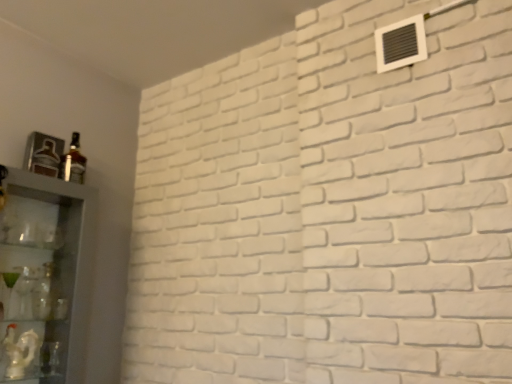
The width and height of the screenshot is (512, 384). What are the coordinates of `white glossy statue at lower left, which ranks as the 2th shelf in top-to-bottom order` in the screenshot? It's located at (31, 353).

I want to click on clear glass cabinet at left, marked as the 2th shelf in a bottom-to-top arrangement, so click(44, 277).

The image size is (512, 384). I want to click on white glossy statue at lower left, marked as the first shelf in a bottom-to-top arrangement, so click(31, 353).

Considering the relative positions of white glossy statue at lower left, which ranks as the 2th shelf in top-to-bottom order, and white plastic air conditioning unit at upper right in the image provided, is white glossy statue at lower left, which ranks as the 2th shelf in top-to-bottom order, to the left of white plastic air conditioning unit at upper right from the viewer's perspective?

Yes, white glossy statue at lower left, which ranks as the 2th shelf in top-to-bottom order, is to the left of white plastic air conditioning unit at upper right.

Could you measure the distance between white glossy statue at lower left, which ranks as the 2th shelf in top-to-bottom order, and white plastic air conditioning unit at upper right?

A distance of 5.27 feet exists between white glossy statue at lower left, which ranks as the 2th shelf in top-to-bottom order, and white plastic air conditioning unit at upper right.

Is there a large distance between white glossy statue at lower left, which ranks as the 2th shelf in top-to-bottom order, and white plastic air conditioning unit at upper right?

Indeed, white glossy statue at lower left, which ranks as the 2th shelf in top-to-bottom order, is not near white plastic air conditioning unit at upper right.

Is white glossy statue at lower left, marked as the first shelf in a bottom-to-top arrangement, positioned beyond the bounds of white plastic air conditioning unit at upper right?

Yes, white glossy statue at lower left, marked as the first shelf in a bottom-to-top arrangement, is outside of white plastic air conditioning unit at upper right.

From the image's perspective, which one is positioned higher, clear glass cabinet at left, marked as the 2th shelf in a bottom-to-top arrangement, or matte glass bottle at left?

matte glass bottle at left is shown above in the image.

Which of these two, clear glass cabinet at left, positioned as the 1th shelf in top-to-bottom order, or matte glass bottle at left, stands shorter?

matte glass bottle at left.

From the picture: Is clear glass cabinet at left, positioned as the 1th shelf in top-to-bottom order, placed right next to matte glass bottle at left?

No.

From the image's perspective, count 1st shelfs downward from the matte glass bottle at left and point to it. Please provide its 2D coordinates.

[(44, 277)]

Based on the photo, are white plastic air conditioning unit at upper right and white glossy statue at lower left, which ranks as the 2th shelf in top-to-bottom order, beside each other?

No, white plastic air conditioning unit at upper right is not with white glossy statue at lower left, which ranks as the 2th shelf in top-to-bottom order.

Who is taller, white plastic air conditioning unit at upper right or white glossy statue at lower left, marked as the first shelf in a bottom-to-top arrangement?

white glossy statue at lower left, marked as the first shelf in a bottom-to-top arrangement, is taller.

Is white plastic air conditioning unit at upper right facing towards white glossy statue at lower left, marked as the first shelf in a bottom-to-top arrangement?

No, white plastic air conditioning unit at upper right is not aimed at white glossy statue at lower left, marked as the first shelf in a bottom-to-top arrangement.

From the image's perspective, is white plastic air conditioning unit at upper right above white glossy statue at lower left, which ranks as the 2th shelf in top-to-bottom order?

Yes, from the image's perspective, white plastic air conditioning unit at upper right is on top of white glossy statue at lower left, which ranks as the 2th shelf in top-to-bottom order.

Locate an element on the screen. shelf in front of the white plastic air conditioning unit at upper right is located at coordinates (44, 277).

From a real-world perspective, which is physically below, white plastic air conditioning unit at upper right or clear glass cabinet at left, positioned as the 1th shelf in top-to-bottom order?

From a 3D spatial view, clear glass cabinet at left, positioned as the 1th shelf in top-to-bottom order, is below.

Does point (378, 64) come farther from viewer compared to point (40, 191)?

No.

Which of these two, white glossy statue at lower left, marked as the first shelf in a bottom-to-top arrangement, or matte glass bottle at left, is bigger?

white glossy statue at lower left, marked as the first shelf in a bottom-to-top arrangement.

Is white glossy statue at lower left, which ranks as the 2th shelf in top-to-bottom order, positioned with its back to matte glass bottle at left?

No, white glossy statue at lower left, which ranks as the 2th shelf in top-to-bottom order, is not facing away from matte glass bottle at left.

Considering the sizes of objects white glossy statue at lower left, marked as the first shelf in a bottom-to-top arrangement, and matte glass bottle at left in the image provided, who is taller, white glossy statue at lower left, marked as the first shelf in a bottom-to-top arrangement, or matte glass bottle at left?

matte glass bottle at left.

Which object is further away from the camera taking this photo, white glossy statue at lower left, which ranks as the 2th shelf in top-to-bottom order, or matte glass bottle at left?

matte glass bottle at left is further away from the camera.

Between matte glass bottle at left and white glossy statue at lower left, which ranks as the 2th shelf in top-to-bottom order, which one appears on the left side from the viewer's perspective?

white glossy statue at lower left, which ranks as the 2th shelf in top-to-bottom order.

Is matte glass bottle at left placed right next to white glossy statue at lower left, marked as the first shelf in a bottom-to-top arrangement?

No.

Considering the sizes of matte glass bottle at left and white glossy statue at lower left, marked as the first shelf in a bottom-to-top arrangement, in the image, is matte glass bottle at left taller or shorter than white glossy statue at lower left, marked as the first shelf in a bottom-to-top arrangement,?

In the image, matte glass bottle at left appears to be taller than white glossy statue at lower left, marked as the first shelf in a bottom-to-top arrangement.

Which is nearer, (83, 170) or (50, 365)?

The point (50, 365) is closer to the camera.

From a real-world perspective, is white glossy statue at lower left, which ranks as the 2th shelf in top-to-bottom order, physically above clear glass cabinet at left, marked as the 2th shelf in a bottom-to-top arrangement?

No.

Considering the sizes of objects white glossy statue at lower left, marked as the first shelf in a bottom-to-top arrangement, and clear glass cabinet at left, positioned as the 1th shelf in top-to-bottom order, in the image provided, who is wider, white glossy statue at lower left, marked as the first shelf in a bottom-to-top arrangement, or clear glass cabinet at left, positioned as the 1th shelf in top-to-bottom order,?

Wider between the two is clear glass cabinet at left, positioned as the 1th shelf in top-to-bottom order.

Consider the image. Is white glossy statue at lower left, which ranks as the 2th shelf in top-to-bottom order, in contact with clear glass cabinet at left, marked as the 2th shelf in a bottom-to-top arrangement?

white glossy statue at lower left, which ranks as the 2th shelf in top-to-bottom order, is not next to clear glass cabinet at left, marked as the 2th shelf in a bottom-to-top arrangement, and they're not touching.

Considering the points (52, 355) and (3, 255), which point is in front, point (52, 355) or point (3, 255)?

The point (52, 355) is more forward.

From a real-world perspective, starting from the white plastic air conditioning unit at upper right, which shelf is the 2nd one below it? Please provide its 2D coordinates.

[(31, 353)]

Find the location of a particular element. bottle that appears on the right of clear glass cabinet at left, marked as the 2th shelf in a bottom-to-top arrangement is located at coordinates (74, 162).

Looking at the image, which one is located further to white plastic air conditioning unit at upper right, clear glass cabinet at left, positioned as the 1th shelf in top-to-bottom order, or matte glass bottle at left?

The object further to white plastic air conditioning unit at upper right is clear glass cabinet at left, positioned as the 1th shelf in top-to-bottom order.

Looking at the image, which one is located closer to white plastic air conditioning unit at upper right, matte glass bottle at left or white glossy statue at lower left, which ranks as the 2th shelf in top-to-bottom order?

matte glass bottle at left is closer to white plastic air conditioning unit at upper right.

When comparing their distances from white glossy statue at lower left, which ranks as the 2th shelf in top-to-bottom order, does white plastic air conditioning unit at upper right or clear glass cabinet at left, marked as the 2th shelf in a bottom-to-top arrangement, seem further?

white plastic air conditioning unit at upper right lies further to white glossy statue at lower left, which ranks as the 2th shelf in top-to-bottom order, than the other object.

Based on their spatial positions, is clear glass cabinet at left, positioned as the 1th shelf in top-to-bottom order, or white plastic air conditioning unit at upper right closer to matte glass bottle at left?

clear glass cabinet at left, positioned as the 1th shelf in top-to-bottom order, is positioned closer to the anchor matte glass bottle at left.

Looking at the image, which one is located closer to matte glass bottle at left, white plastic air conditioning unit at upper right or white glossy statue at lower left, marked as the first shelf in a bottom-to-top arrangement?

white glossy statue at lower left, marked as the first shelf in a bottom-to-top arrangement, lies closer to matte glass bottle at left than the other object.

Which object lies nearer to the anchor point white glossy statue at lower left, which ranks as the 2th shelf in top-to-bottom order, matte glass bottle at left or white plastic air conditioning unit at upper right?

Among the two, matte glass bottle at left is located nearer to white glossy statue at lower left, which ranks as the 2th shelf in top-to-bottom order.

From the image, which object appears to be nearer to white glossy statue at lower left, marked as the first shelf in a bottom-to-top arrangement, clear glass cabinet at left, positioned as the 1th shelf in top-to-bottom order, or white plastic air conditioning unit at upper right?

The object closer to white glossy statue at lower left, marked as the first shelf in a bottom-to-top arrangement, is clear glass cabinet at left, positioned as the 1th shelf in top-to-bottom order.

From the image, which object appears to be farther from clear glass cabinet at left, marked as the 2th shelf in a bottom-to-top arrangement, matte glass bottle at left or white glossy statue at lower left, which ranks as the 2th shelf in top-to-bottom order?

Among the two, matte glass bottle at left is located further to clear glass cabinet at left, marked as the 2th shelf in a bottom-to-top arrangement.

Identify the location of bottle located between clear glass cabinet at left, positioned as the 1th shelf in top-to-bottom order, and white plastic air conditioning unit at upper right in the left-right direction. The image size is (512, 384). (74, 162).

The height and width of the screenshot is (384, 512). What are the coordinates of `shelf located between white glossy statue at lower left, marked as the first shelf in a bottom-to-top arrangement, and white plastic air conditioning unit at upper right in the left-right direction` in the screenshot? It's located at pos(44,277).

Locate an element on the screen. shelf between matte glass bottle at left and white glossy statue at lower left, which ranks as the 2th shelf in top-to-bottom order, in the vertical direction is located at coordinates (44, 277).

Locate an element on the screen. The height and width of the screenshot is (384, 512). bottle between white glossy statue at lower left, which ranks as the 2th shelf in top-to-bottom order, and white plastic air conditioning unit at upper right from left to right is located at coordinates (74, 162).